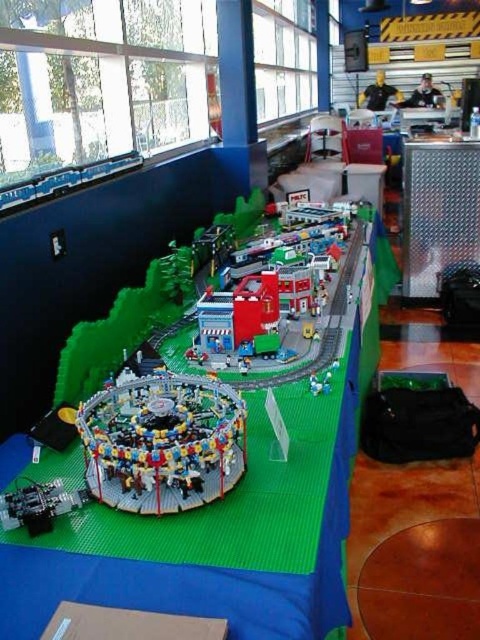
You are a delivery drone with a wingspan of 1.5 meters. You need to fly between the matte blue plastic building at center and the nearest object. Is there enough space for you to pass through?

The distance between the matte blue plastic building at center and the nearest object is 1.79 meters. Since your wingspan is 1.5 meters, there is sufficient space for you to pass through safely.

Looking at this image, you are a visitor standing in front of the LEGO city model. You want to walk from the metallic gray train at lower left to the brick red train station at center. Which direction should you move towards?

You should move towards the brick red train station at center, which is closer to you than the metallic gray train at lower left, so you need to walk forward towards it.

You are standing at the point with coordinates point (267,296) in the LEGO model city. What is the name of the building you are currently standing on?

The point (267,296) corresponds to the brick red train station at center, so you are standing on the brick red train station at center.